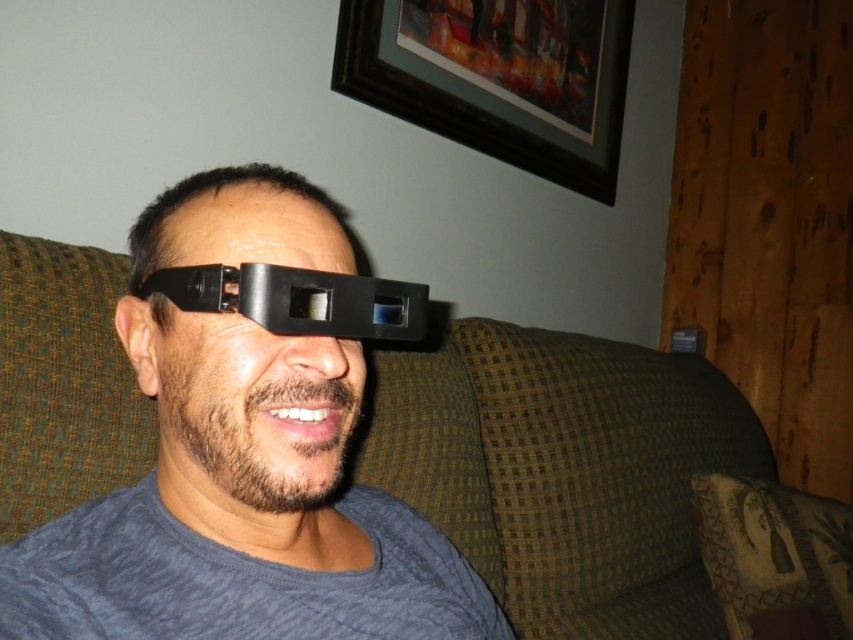
Question: Which of the following is the closest to the observer?

Choices:
 (A) black matte/glossy goggles at center
 (B) black matte glasses at center

Answer: (B)

Question: Can you confirm if black matte glasses at center is positioned to the left of black matte/glossy goggles at center?

Choices:
 (A) yes
 (B) no

Answer: (A)

Question: Which point is farther to the camera?

Choices:
 (A) (294, 269)
 (B) (146, 260)

Answer: (B)

Question: Can you confirm if black matte glasses at center is positioned above black matte/glossy goggles at center?

Choices:
 (A) yes
 (B) no

Answer: (B)

Question: Is black matte glasses at center further to camera compared to black matte/glossy goggles at center?

Choices:
 (A) yes
 (B) no

Answer: (B)